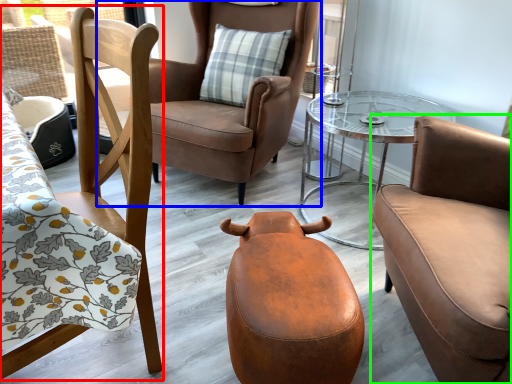
Question: Considering the real-world distances, which object is closest to chair (highlighted by a red box)? chair (highlighted by a blue box) or chair (highlighted by a green box).

Choices:
 (A) chair
 (B) chair

Answer: (B)